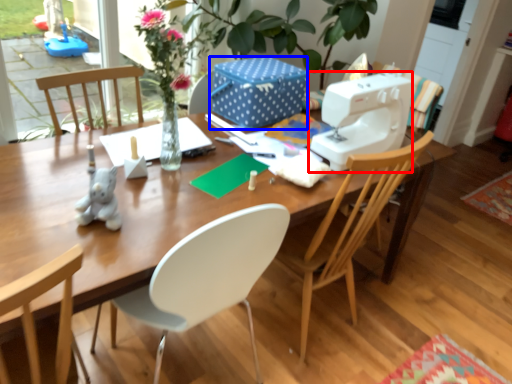
Question: Which object appears closest to the camera in this image, sewing machine (highlighted by a red box) or box (highlighted by a blue box)?

Choices:
 (A) sewing machine
 (B) box

Answer: (A)